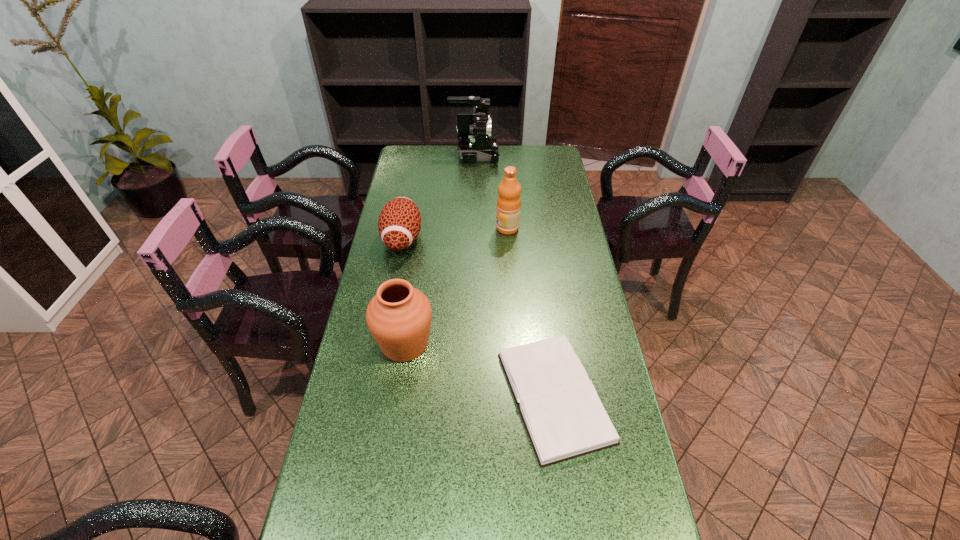
I want to click on free space located 0.270m on the front of the football, so click(386, 325).

The height and width of the screenshot is (540, 960). Identify the location of free space located 0.130m on the left of the shortest object. (450, 396).

I want to click on object present at the far edge, so click(475, 142).

Where is `urn positioned at the left edge`? urn positioned at the left edge is located at coordinates (399, 316).

The image size is (960, 540). What are the coordinates of `football located at the left edge` in the screenshot? It's located at (399, 224).

Locate an element on the screen. object located at the right edge is located at coordinates (564, 418).

In the image, there is a desktop. Where is `free region at the far edge`? The image size is (960, 540). free region at the far edge is located at coordinates (519, 148).

In the image, there is a desktop. Where is `vacant space at the left edge`? The image size is (960, 540). vacant space at the left edge is located at coordinates (328, 490).

Identify the location of blank space at the right edge of the desktop. This screenshot has width=960, height=540. (551, 191).

The width and height of the screenshot is (960, 540). In order to click on free space between the urn and the shortest object in this screenshot , I will do `click(479, 370)`.